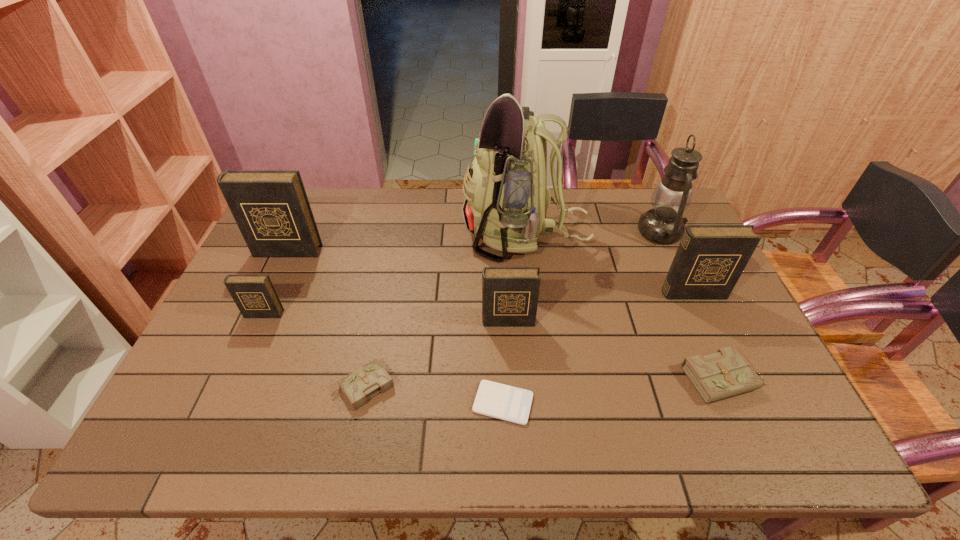
I want to click on the right green diary, so point(726,373).

Find the location of `the second shortest diary`. the second shortest diary is located at coordinates (726, 373).

Where is `the fourth diary from right to left`? the fourth diary from right to left is located at coordinates (367, 381).

You are a GUI agent. You are given a task and a screenshot of the screen. Output one action in this format:
    pyautogui.click(x=<x>, y=<y>)
    Task: Click on the shortest diary
    
    Given the screenshot: What is the action you would take?
    pyautogui.click(x=367, y=381)

Locate an element on the screen. the shortest object is located at coordinates (501, 401).

The image size is (960, 540). In order to click on white calculator in this screenshot , I will do `click(501, 401)`.

At what (x,y) coordinates should I click in order to perform the action: click on vacant area situated on the front-facing side of the tallest object. Please return your answer as a coordinate pair (x, y). This screenshot has width=960, height=540. Looking at the image, I should click on (428, 234).

At what (x,y) coordinates should I click in order to perform the action: click on free space located 0.240m on the front-facing side of the tallest object. Please return your answer as a coordinate pair (x, y). The image size is (960, 540). Looking at the image, I should click on (389, 234).

Where is `free space located 0.370m on the front-facing side of the tallest object`? free space located 0.370m on the front-facing side of the tallest object is located at coordinates (348, 234).

Image resolution: width=960 pixels, height=540 pixels. In order to click on blank area located 0.320m on the front of the oil lamp in this screenshot , I will do `click(707, 334)`.